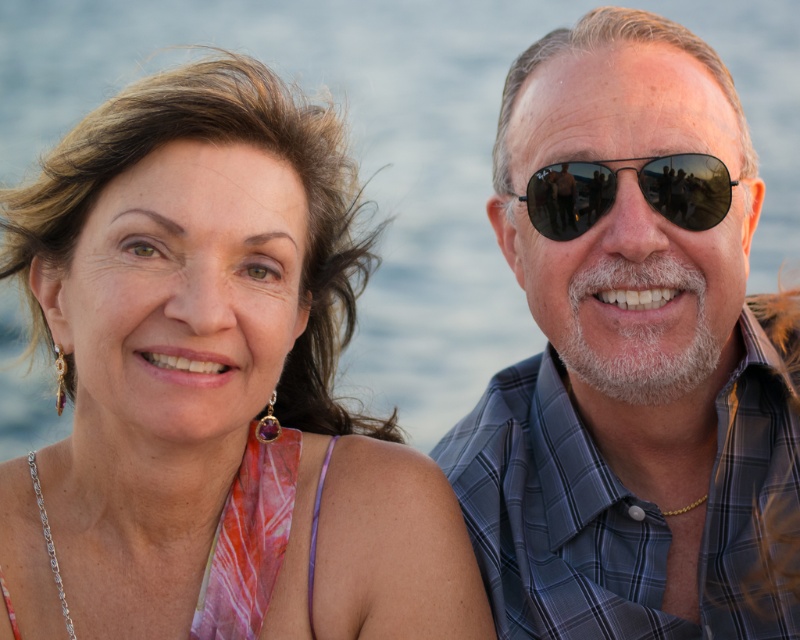
Does matte gold earrings at upper left appear over transparent water at center?

No.

The height and width of the screenshot is (640, 800). Identify the location of matte gold earrings at upper left. (212, 387).

Between point (372, 618) and point (650, 289), which one is positioned in front?

Positioned in front is point (372, 618).

Who is more distant from viewer, (318, 280) or (554, 381)?

Point (554, 381)

Is point (126, 276) less distant than point (624, 220)?

Yes, point (126, 276) is in front of point (624, 220).

The image size is (800, 640). Find the location of `matte gold earrings at upper left`. matte gold earrings at upper left is located at coordinates (212, 387).

From the picture: Does transparent water at center appear on the right side of black reflective sunglasses at right?

In fact, transparent water at center is to the left of black reflective sunglasses at right.

Can you confirm if transparent water at center is taller than black reflective sunglasses at right?

Yes.

Describe the element at coordinates (402, 147) in the screenshot. The width and height of the screenshot is (800, 640). I see `transparent water at center` at that location.

Locate an element on the screen. The height and width of the screenshot is (640, 800). transparent water at center is located at coordinates (402, 147).